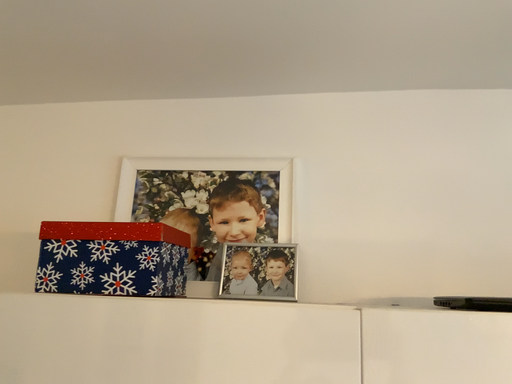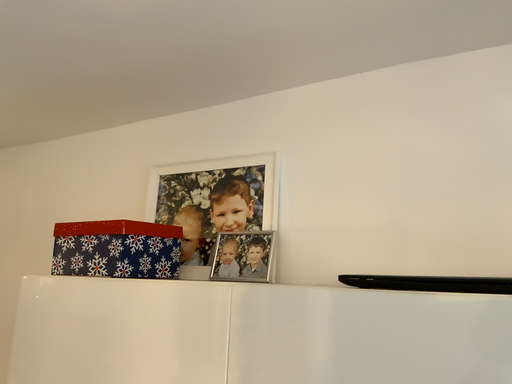
Question: How did the camera likely rotate when shooting the video?

Choices:
 (A) rotated left
 (B) rotated right

Answer: (A)